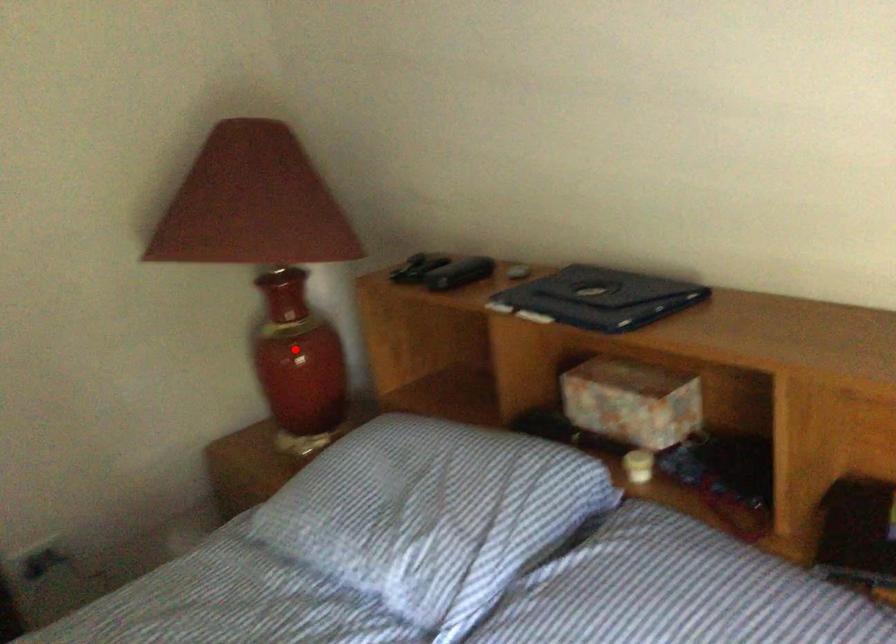
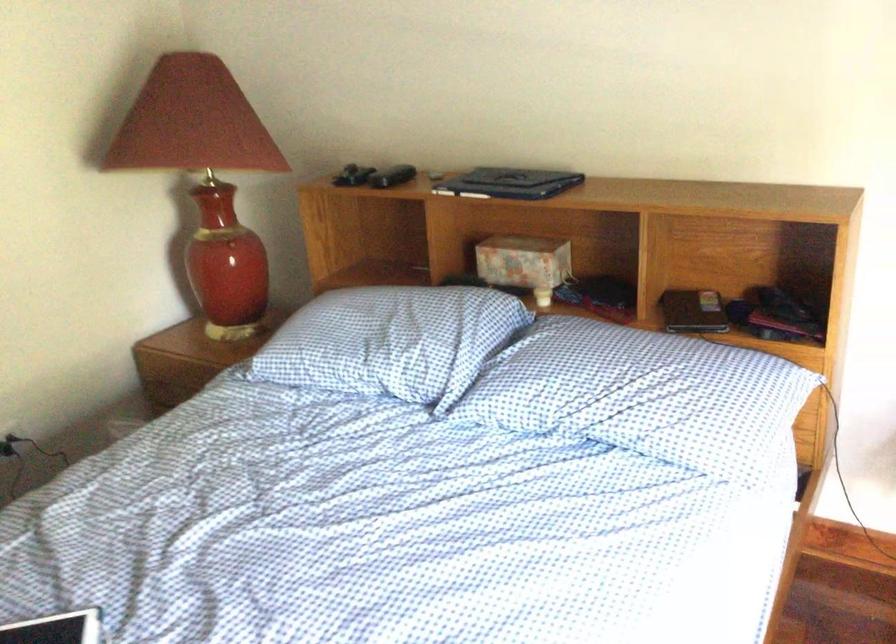
Question: I am providing you with two images of the same scene from different viewpoints. A red point is shown in image1. For the corresponding object point in image2, is it positioned nearer or farther from the camera?

Choices:
 (A) Nearer
 (B) Farther

Answer: (B)